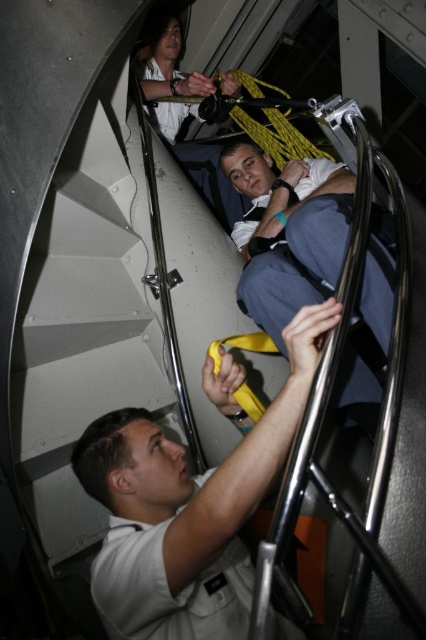
Question: In this image, where is white/stainless steel stairs at lower left located relative to matte white shirt at upper center?

Choices:
 (A) above
 (B) below

Answer: (B)

Question: Can you confirm if white/stainless steel stairs at lower left is smaller than light blue denim pants at center?

Choices:
 (A) no
 (B) yes

Answer: (B)

Question: Which object is positioned closest to the light blue denim pants at center?

Choices:
 (A) white/stainless steel stairs at lower left
 (B) white matte shirt at center

Answer: (B)

Question: Which point is closer to the camera?

Choices:
 (A) light blue denim pants at center
 (B) white/stainless steel stairs at lower left
 (C) white matte shirt at center

Answer: (C)

Question: Which of the following is the closest to the observer?

Choices:
 (A) white matte shirt at center
 (B) light blue denim pants at center
 (C) white/stainless steel stairs at lower left

Answer: (A)

Question: Is white/stainless steel stairs at lower left positioned in front of white matte shirt at center?

Choices:
 (A) no
 (B) yes

Answer: (A)